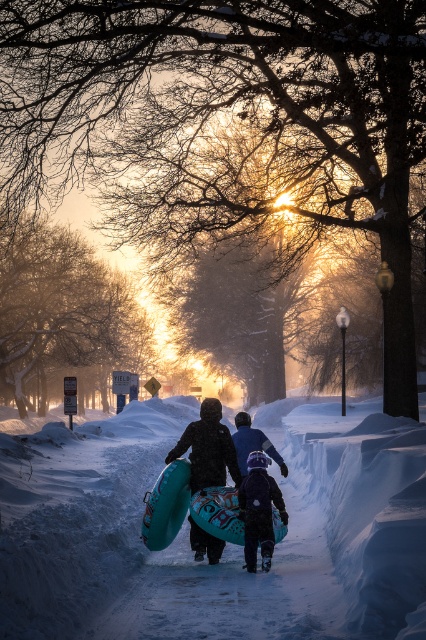
Question: Which object is the farthest from the white fluffy snow at center?

Choices:
 (A) teal rubber tube at center
 (B) blue rubber tube at center
 (C) dark blue snowsuit at center

Answer: (A)

Question: Which object appears closest to the camera in this image?

Choices:
 (A) dark blue snowsuit at center
 (B) teal rubber tube at center

Answer: (A)

Question: Which point appears farthest from the camera in this image?

Choices:
 (A) (244, 547)
 (B) (198, 556)

Answer: (B)

Question: Is teal rubber tube at center below blue rubber tube at center?

Choices:
 (A) yes
 (B) no

Answer: (B)

Question: Can you confirm if dark blue snowsuit at center is smaller than blue rubber tube at center?

Choices:
 (A) no
 (B) yes

Answer: (B)

Question: Does white fluffy snow at center appear under blue rubber tube at center?

Choices:
 (A) yes
 (B) no

Answer: (A)